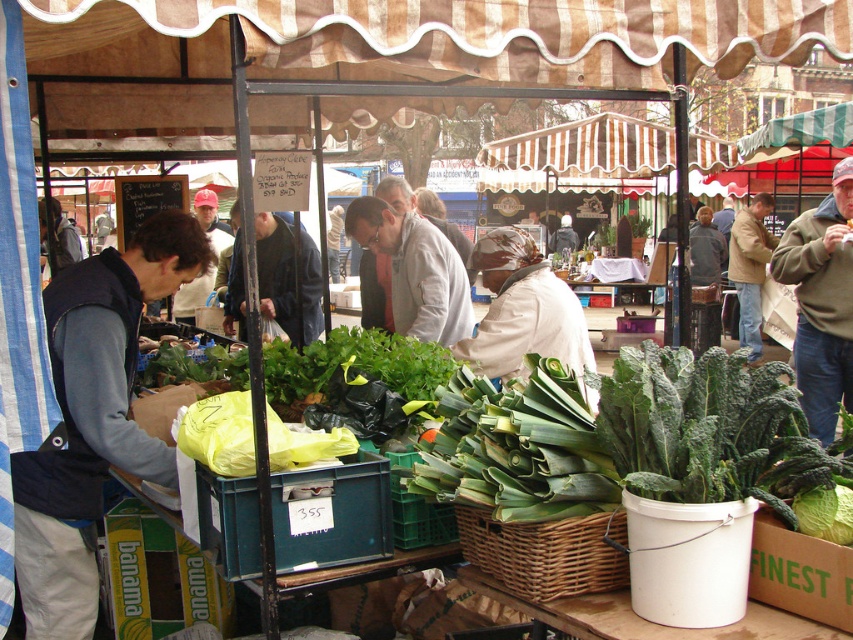
From the picture: Who is shorter, dark blue jacket at left or green leafy at center?

With less height is green leafy at center.

Between dark blue jacket at left and green leafy at center, which one appears on the left side from the viewer's perspective?

dark blue jacket at left is more to the left.

Is point (28, 570) positioned before point (552, 452)?

No, (28, 570) is behind (552, 452).

This screenshot has height=640, width=853. I want to click on dark blue jacket at left, so click(x=93, y=419).

Can you confirm if light gray fabric shirt at center is wider than tan leather jacket at upper right?

No, light gray fabric shirt at center is not wider than tan leather jacket at upper right.

Between point (434, 339) and point (755, 337), which one is positioned in front?

Point (434, 339) is in front.

Does point (399, 218) come farther from viewer compared to point (747, 252)?

No, (399, 218) is in front of (747, 252).

You are a GUI agent. You are given a task and a screenshot of the screen. Output one action in this format:
    pyautogui.click(x=<x>, y=<y>)
    Task: Click on the light gray fabric shirt at center
    This screenshot has height=640, width=853.
    Given the screenshot: What is the action you would take?
    pyautogui.click(x=415, y=269)

Which of these two, dark blue jacket at left or light gray fabric shirt at center, stands shorter?

light gray fabric shirt at center is shorter.

Between point (131, 467) and point (408, 280), which one is positioned behind?

Point (408, 280)

Image resolution: width=853 pixels, height=640 pixels. Identify the location of dark blue jacket at left. (93, 419).